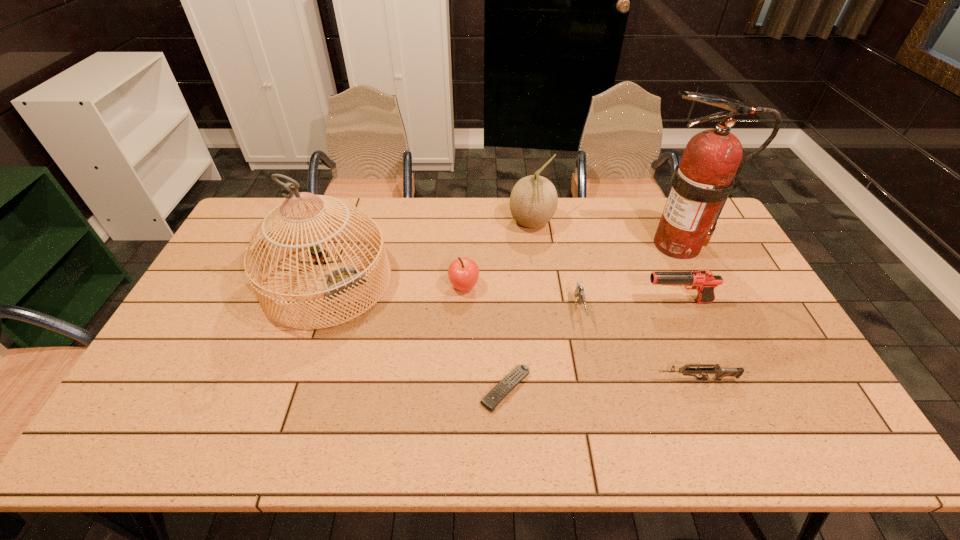
You are a GUI agent. You are given a task and a screenshot of the screen. Output one action in this format:
    pyautogui.click(x=<x>, y=<y>)
    Task: Click on the free spot between the leftmost gun and the tallest object
    This screenshot has width=960, height=540.
    Given the screenshot: What is the action you would take?
    pyautogui.click(x=628, y=278)

This screenshot has width=960, height=540. What are the coordinates of `empty space that is in between the tallest gun and the seventh tallest object` in the screenshot? It's located at (686, 341).

Locate an element on the screen. The width and height of the screenshot is (960, 540). object that is the third nearest to the leftmost object is located at coordinates (533, 201).

Where is `object that is the fourth nearest to the remote control`? object that is the fourth nearest to the remote control is located at coordinates (719, 372).

At what (x,y) coordinates should I click in order to perform the action: click on gun identified as the closest to the nearest gun. Please return your answer as a coordinate pair (x, y). This screenshot has height=540, width=960. Looking at the image, I should click on (579, 292).

You are a GUI agent. You are given a task and a screenshot of the screen. Output one action in this format:
    pyautogui.click(x=<x>, y=<y>)
    Task: Click on the third closest gun to the apple
    Image resolution: width=960 pixels, height=540 pixels.
    Given the screenshot: What is the action you would take?
    pyautogui.click(x=719, y=372)